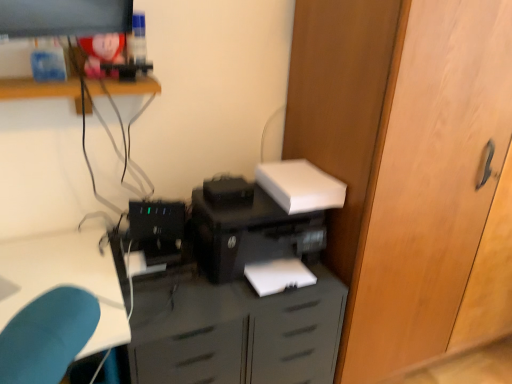
Question: From the image's perspective, is black plastic printer at center located above or below black plastic computer tower at center?

Choices:
 (A) below
 (B) above

Answer: (A)

Question: From a real-world perspective, is black plastic printer at center physically located above or below black plastic computer tower at center?

Choices:
 (A) above
 (B) below

Answer: (B)

Question: Estimate the real-world distances between objects in this image. Which object is farther from the wooden shelf at upper left?

Choices:
 (A) matte black printer at lower center
 (B) black plastic printer at center
 (C) wooden door at center-right
 (D) black plastic computer tower at center

Answer: (C)

Question: Estimate the real-world distances between objects in this image. Which object is farther from the black plastic computer tower at center?

Choices:
 (A) wooden shelf at upper left
 (B) wooden door at center-right
 (C) matte black printer at lower center
 (D) black plastic printer at center

Answer: (B)